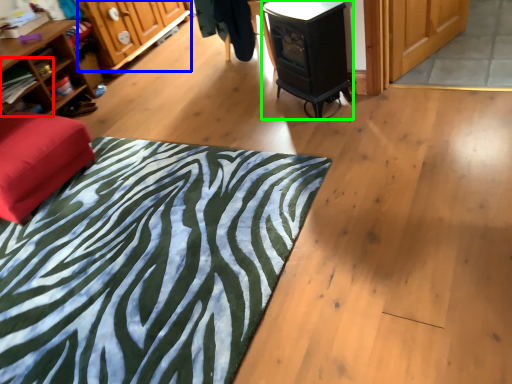
Question: Considering the real-world distances, which object is farthest from shelf (highlighted by a red box)? cabinetry (highlighted by a blue box) or stove (highlighted by a green box)?

Choices:
 (A) cabinetry
 (B) stove

Answer: (B)